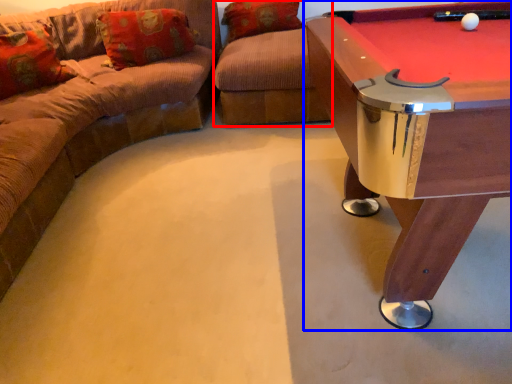
Question: Which object is further to the camera taking this photo, swivel chair (highlighted by a red box) or table (highlighted by a blue box)?

Choices:
 (A) swivel chair
 (B) table

Answer: (A)